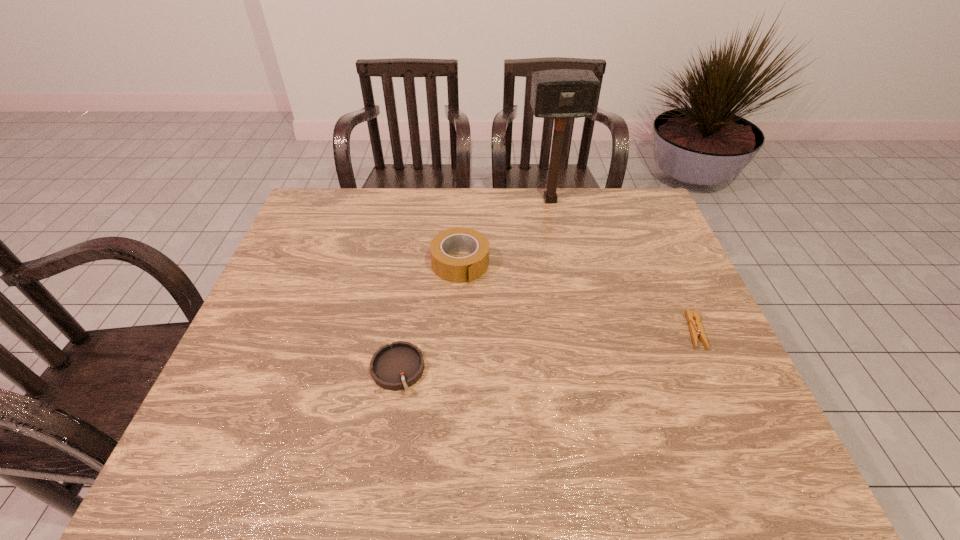
Locate an element on the screen. Image resolution: width=960 pixels, height=540 pixels. ashtray is located at coordinates (397, 366).

The width and height of the screenshot is (960, 540). I want to click on the rightmost object, so pyautogui.click(x=696, y=329).

You are a GUI agent. You are given a task and a screenshot of the screen. Output one action in this format:
    pyautogui.click(x=<x>, y=<y>)
    Task: Click on the clothespin
    Image resolution: width=960 pixels, height=540 pixels.
    Given the screenshot: What is the action you would take?
    pyautogui.click(x=696, y=329)

Where is `duct tape`? This screenshot has height=540, width=960. duct tape is located at coordinates (455, 269).

This screenshot has width=960, height=540. In order to click on the third shortest object in this screenshot , I will do `click(455, 269)`.

Image resolution: width=960 pixels, height=540 pixels. I want to click on the second object from right to left, so [558, 94].

Where is `the tallest object`? the tallest object is located at coordinates (558, 94).

This screenshot has width=960, height=540. Find the location of `vacant space located on the right of the ashtray`. vacant space located on the right of the ashtray is located at coordinates (528, 370).

Find the location of a particular element. free space located on the left of the clothespin is located at coordinates (646, 331).

Where is `vacant point located at the edge of the second farthest object`? This screenshot has height=540, width=960. vacant point located at the edge of the second farthest object is located at coordinates (485, 311).